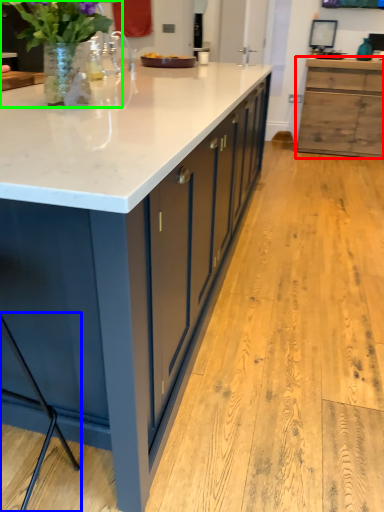
Question: Estimate the real-world distances between objects in this image. Which object is closer to cabinetry (highlighted by a red box), bar stool (highlighted by a blue box) or houseplant (highlighted by a green box)?

Choices:
 (A) bar stool
 (B) houseplant

Answer: (B)